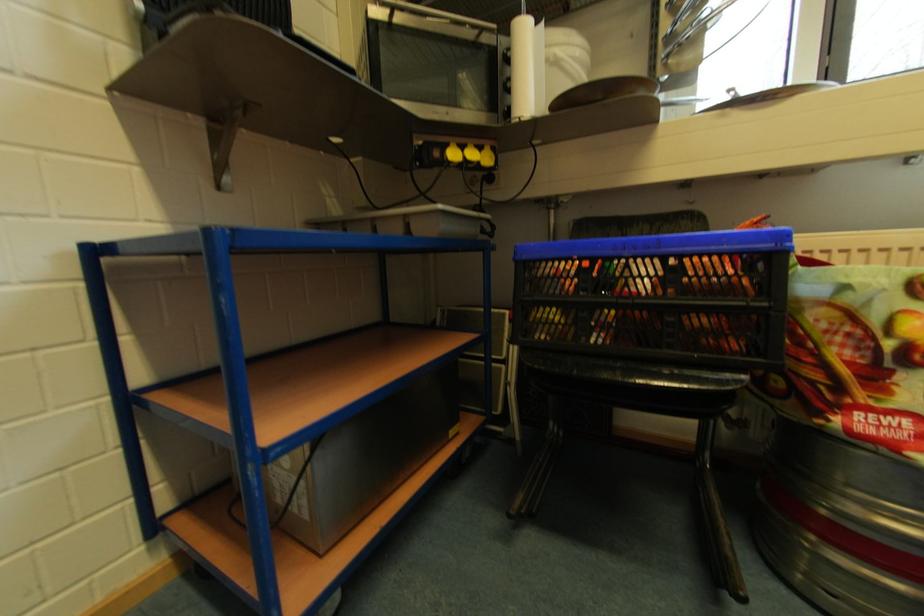
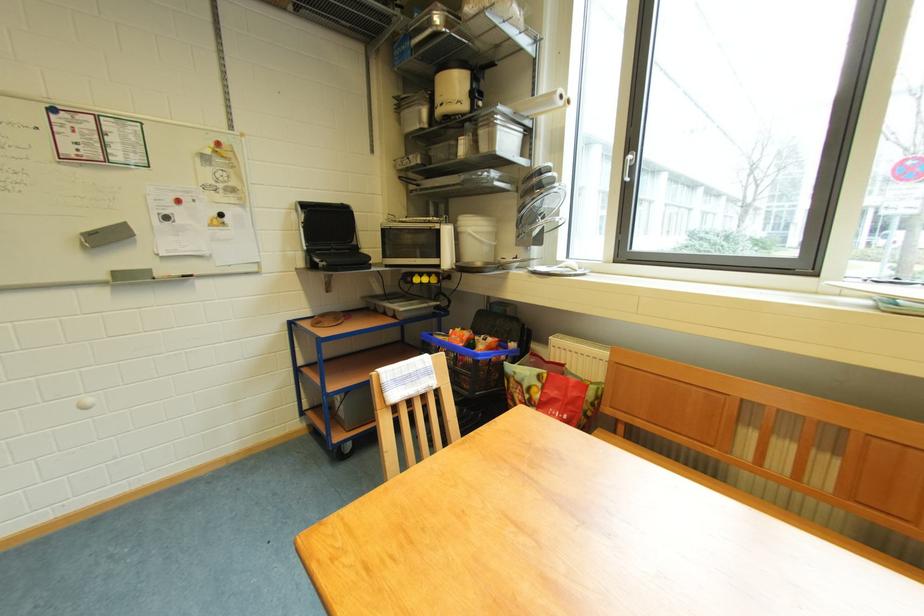
Where in the second image is the point corresponding to pixel 444 156 from the first image?

(417, 282)